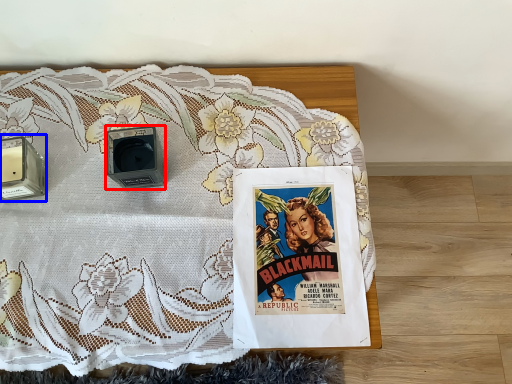
Question: Which object is closer to the camera taking this photo, speaker (highlighted by a red box) or speaker (highlighted by a blue box)?

Choices:
 (A) speaker
 (B) speaker

Answer: (A)